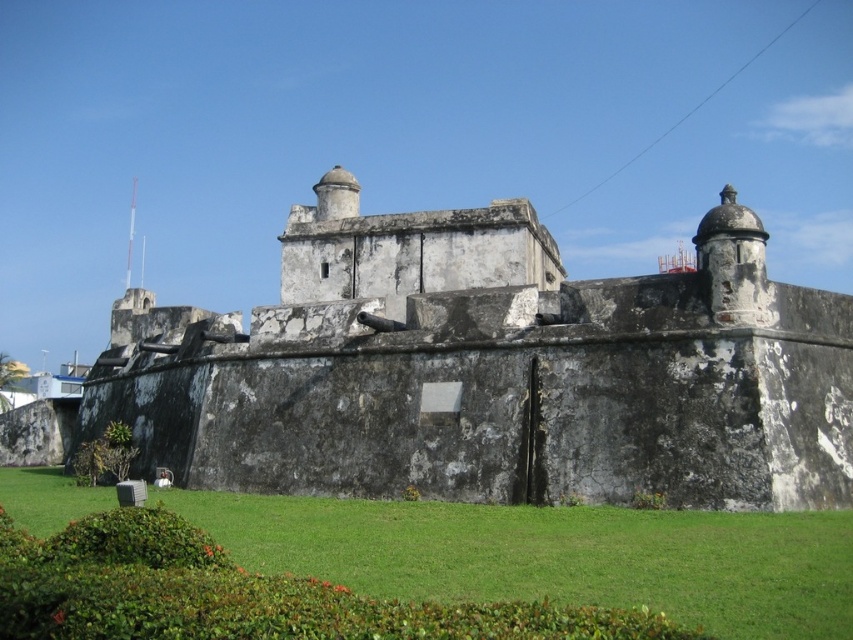
Question: Can you confirm if weathered stone wall at center is positioned below green grass at lower center?

Choices:
 (A) no
 (B) yes

Answer: (A)

Question: Is weathered stone wall at center thinner than green grass at lower center?

Choices:
 (A) yes
 (B) no

Answer: (B)

Question: Which point is farther from the camera taking this photo?

Choices:
 (A) (318, 385)
 (B) (200, 515)

Answer: (A)

Question: Which object is farther from the camera taking this photo?

Choices:
 (A) green grass at lower center
 (B) weathered stone wall at center

Answer: (B)

Question: Is the position of weathered stone wall at center more distant than that of green grass at lower center?

Choices:
 (A) yes
 (B) no

Answer: (A)

Question: Which object appears farthest from the camera in this image?

Choices:
 (A) green grass at lower center
 (B) weathered stone wall at center

Answer: (B)